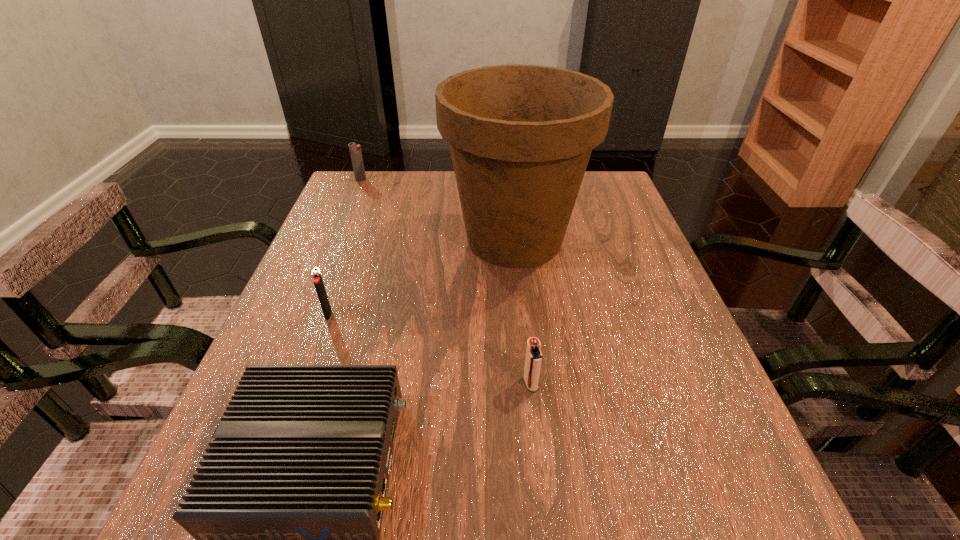
Locate which object ranks fourth in proximity to the second nearest igniter. Please provide its 2D coordinates. Your answer should be formatted as a tuple, i.e. [(x, y)], where the tuple contains the x and y coordinates of a point satisfying the conditions above.

[(355, 151)]

Find the location of `igniter that can be found as the second closest to the second igniter from left to right`. igniter that can be found as the second closest to the second igniter from left to right is located at coordinates (355, 151).

Where is `the closest igniter relative to the second farthest igniter`? the closest igniter relative to the second farthest igniter is located at coordinates (533, 361).